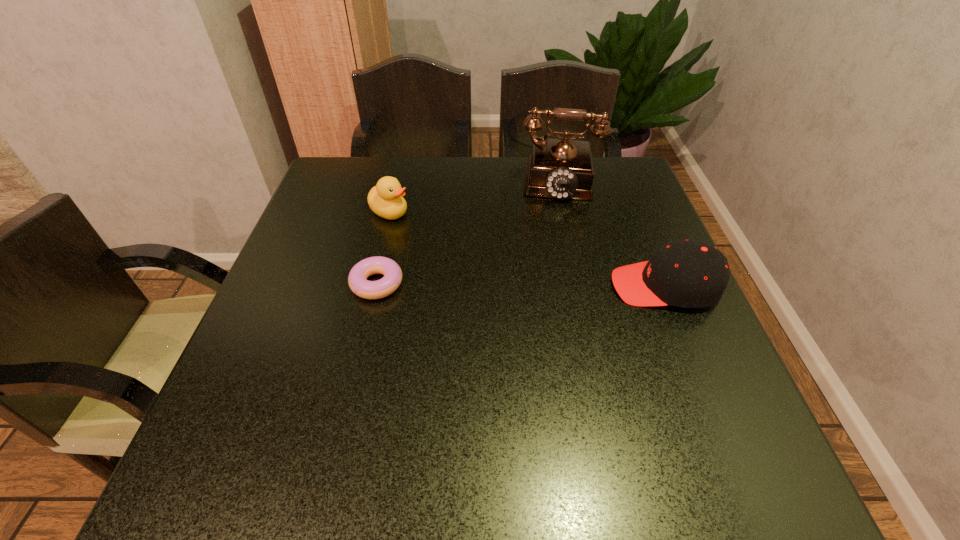
Find the location of a particular element. Image resolution: width=960 pixels, height=540 pixels. vacant spot on the desktop that is between the doughnut and the cap and is positioned on the face of the duckling is located at coordinates (524, 285).

Where is `vacant space on the desktop that is between the shortest object and the cap and is positioned on the dial of the telephone`? vacant space on the desktop that is between the shortest object and the cap and is positioned on the dial of the telephone is located at coordinates (547, 285).